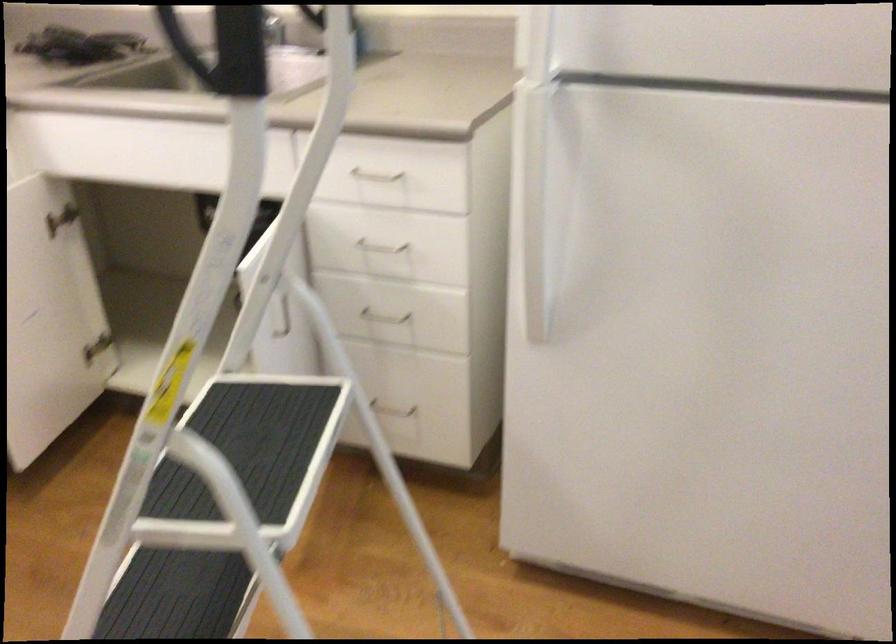
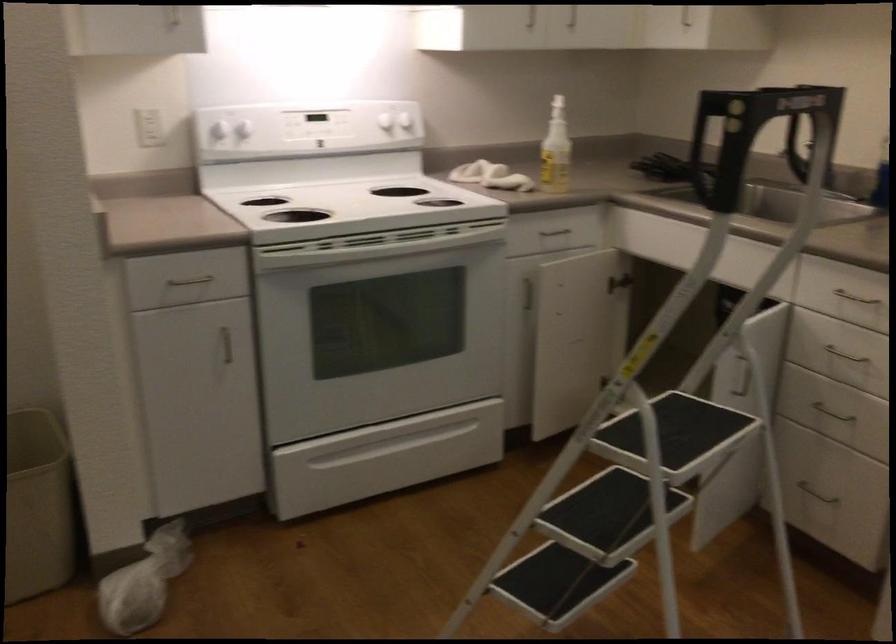
Where in the second image is the point corresponding to pixel 388 410 from the first image?

(815, 493)